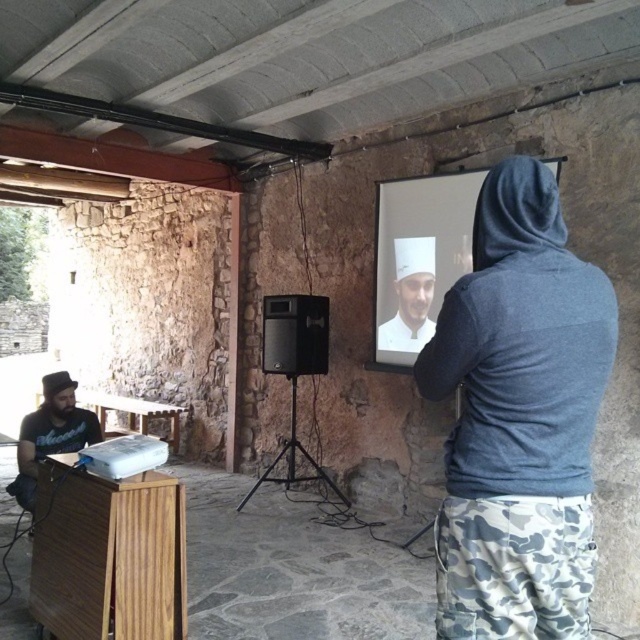
Question: Considering the real-world distances, which object is closest to the white glossy projection screen at center?

Choices:
 (A) gray hoodie at center
 (B) black matte speaker at center

Answer: (B)

Question: Among these objects, which one is nearest to the camera?

Choices:
 (A) black matte t-shirt at left
 (B) white glossy projection screen at center
 (C) black matte speaker at center

Answer: (A)

Question: Among these points, which one is farthest from the camera?

Choices:
 (A) (429, 218)
 (B) (52, 408)
 (C) (289, 304)
 (D) (442, 628)

Answer: (C)

Question: Can you confirm if white glossy projection screen at center is bigger than black matte t-shirt at left?

Choices:
 (A) no
 (B) yes

Answer: (B)

Question: In this image, where is gray hoodie at center located relative to black matte speaker at center?

Choices:
 (A) below
 (B) above

Answer: (A)

Question: Can you confirm if gray hoodie at center is thinner than white matte chef hat at upper center?

Choices:
 (A) no
 (B) yes

Answer: (A)